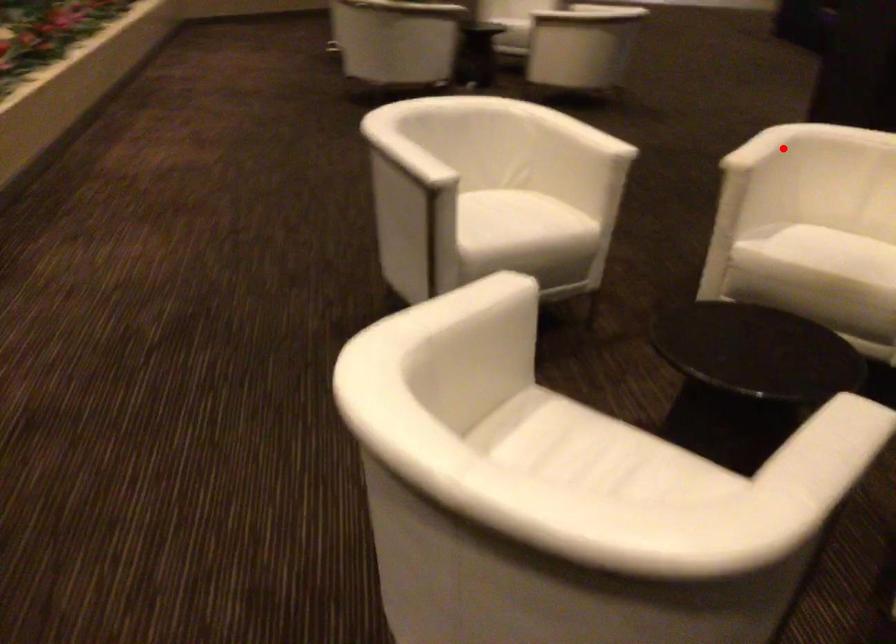
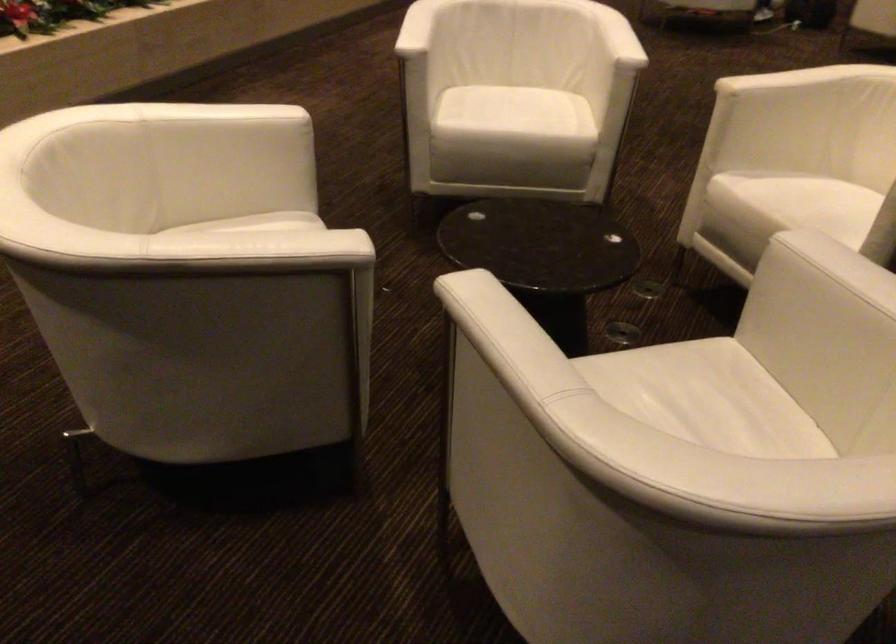
Question: I am providing you with two images of the same scene from different viewpoints. In image1, a red point is highlighted. Considering the same 3D point in image2, which of the following is correct?

Choices:
 (A) It is closer
 (B) It is farther

Answer: (A)